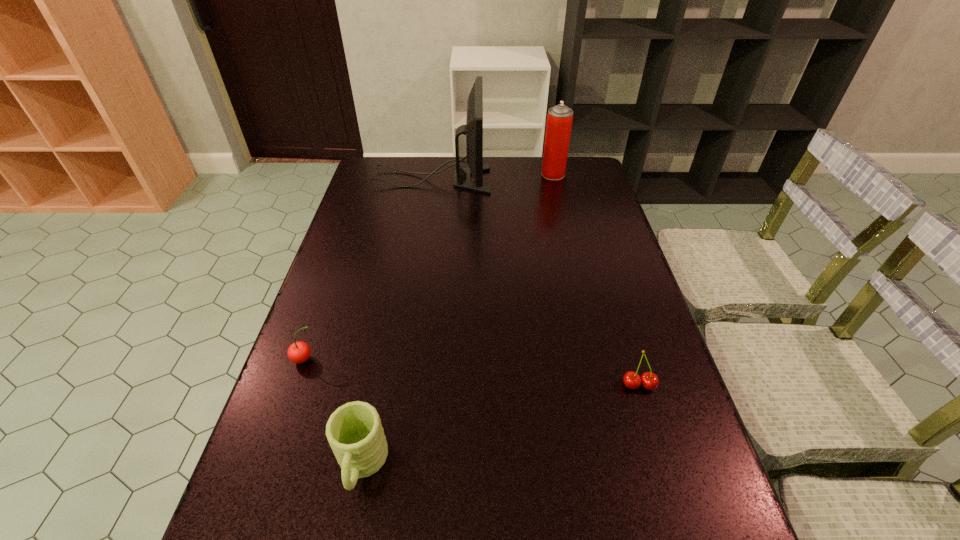
Find the location of a particular element. The width and height of the screenshot is (960, 540). free space located with the stems of the right cherry pointing upwards is located at coordinates (650, 422).

Where is `computer monitor located in the far edge section of the desktop`? This screenshot has height=540, width=960. computer monitor located in the far edge section of the desktop is located at coordinates (473, 129).

This screenshot has width=960, height=540. I want to click on aerosol can that is positioned at the far edge, so click(x=559, y=119).

You are a GUI agent. You are given a task and a screenshot of the screen. Output one action in this format:
    pyautogui.click(x=<x>, y=<y>)
    Task: Click on the computer monitor that is at the left edge
    Image resolution: width=960 pixels, height=540 pixels.
    Given the screenshot: What is the action you would take?
    pyautogui.click(x=473, y=129)

Image resolution: width=960 pixels, height=540 pixels. Find the location of `mug at the left edge`. mug at the left edge is located at coordinates (354, 431).

At what (x,y) coordinates should I click in order to perform the action: click on cherry that is at the left edge. Please return your answer as a coordinate pair (x, y). This screenshot has width=960, height=540. Looking at the image, I should click on (299, 352).

Where is `aerosol can present at the right edge`? aerosol can present at the right edge is located at coordinates (559, 119).

The image size is (960, 540). I want to click on cherry that is at the right edge, so click(649, 380).

The width and height of the screenshot is (960, 540). Find the location of `object that is at the far left corner`. object that is at the far left corner is located at coordinates (473, 129).

The height and width of the screenshot is (540, 960). Identify the location of object positioned at the far right corner. (559, 119).